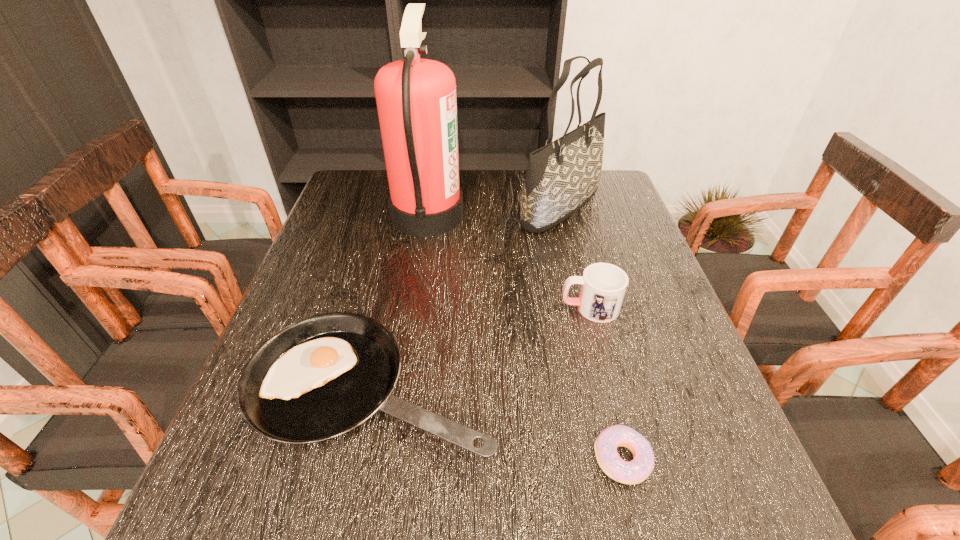
Locate an element on the screen. The image size is (960, 540). free space that is in between the frying pan and the second tallest object is located at coordinates (466, 299).

Image resolution: width=960 pixels, height=540 pixels. I want to click on vacant space in between the third tallest object and the frying pan, so click(481, 349).

This screenshot has height=540, width=960. Identify the location of free space between the third nearest object and the fire extinguisher. (509, 261).

Image resolution: width=960 pixels, height=540 pixels. I want to click on empty space that is in between the fourth tallest object and the mug, so coord(481,349).

The image size is (960, 540). Identify the location of vacant area that lies between the tallest object and the doughnut. (525, 337).

Image resolution: width=960 pixels, height=540 pixels. I want to click on empty location between the fire extinguisher and the tote bag, so coord(494,211).

The height and width of the screenshot is (540, 960). What are the coordinates of `object that is the second closest to the fourth tallest object` in the screenshot? It's located at (635, 471).

Image resolution: width=960 pixels, height=540 pixels. I want to click on object that can be found as the fourth closest to the doughnut, so click(x=561, y=177).

Locate an element on the screen. The image size is (960, 540). vacant position in the image that satisfies the following two spatial constraints: 1. at the nozzle of the tallest object; 2. on the left side of the shortest object is located at coordinates (390, 459).

Locate an element on the screen. vacant region that satisfies the following two spatial constraints: 1. at the nozzle of the fire extinguisher; 2. on the front side of the frying pan is located at coordinates (400, 390).